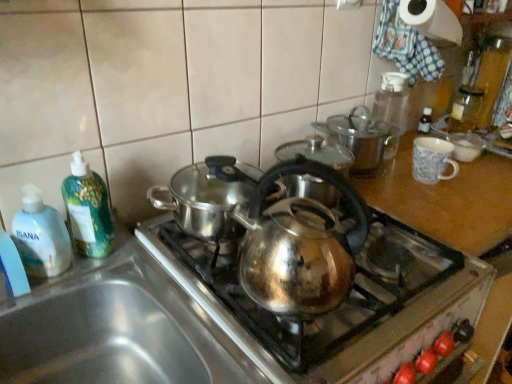
This screenshot has height=384, width=512. What are the coordinates of `free space in front of shiny metallic pot at upper center` in the screenshot? It's located at (401, 198).